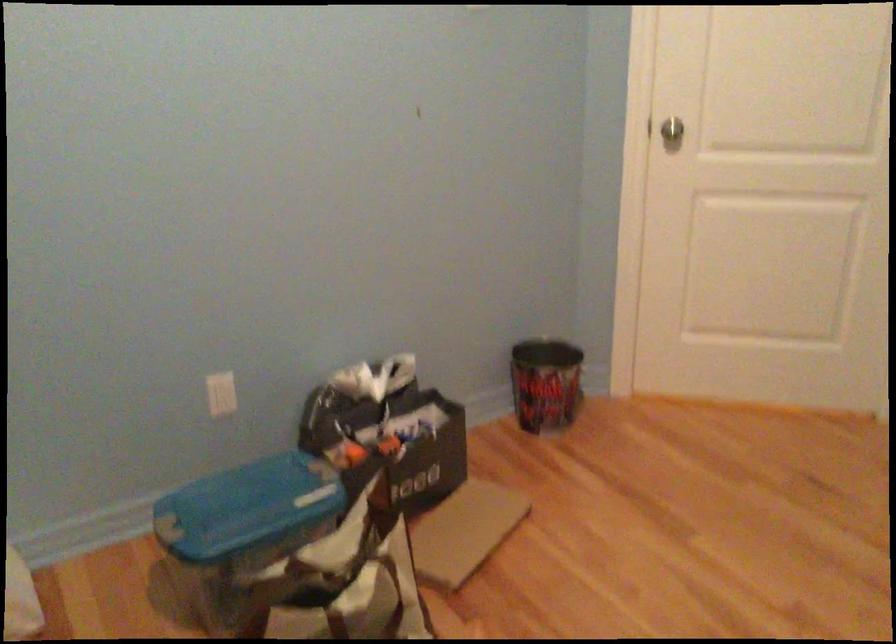
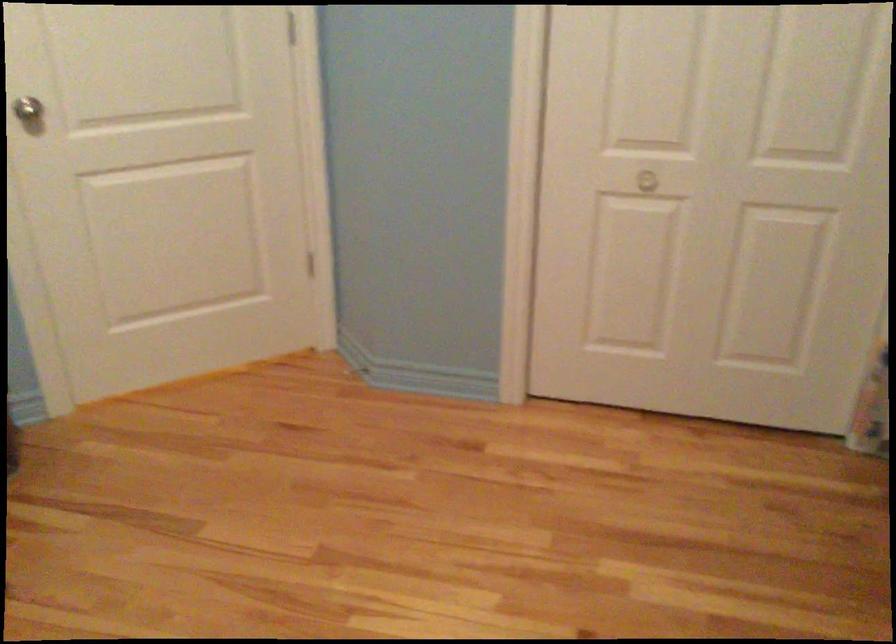
Question: The camera is either moving clockwise (left) or counter-clockwise (right) around the object. The first image is from the beginning of the video and the second image is from the end. Is the camera moving left or right when shooting the video?

Choices:
 (A) Left
 (B) Right

Answer: (A)